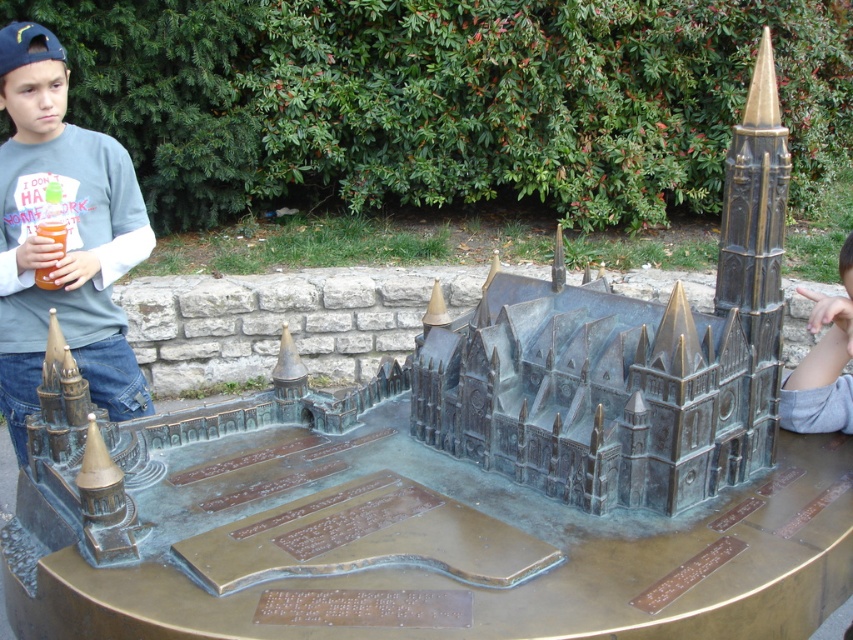
You are standing in front of the Gothic castle model and notice the matte gray shirt at left and the gray fabric hand at lower right. Based on their positions, which one is closer to the top of the image?

The matte gray shirt at left is located above the gray fabric hand at lower right, so it is closer to the top of the image.

You are a photographer taking a picture of the Gothic castle model. You notice the matte gray shirt at left and the translucent plastic cup at left in the background. Which object is closer to the right side of the frame?

The matte gray shirt at left is closer to the right side of the frame since it is positioned to the right of the translucent plastic cup at left.